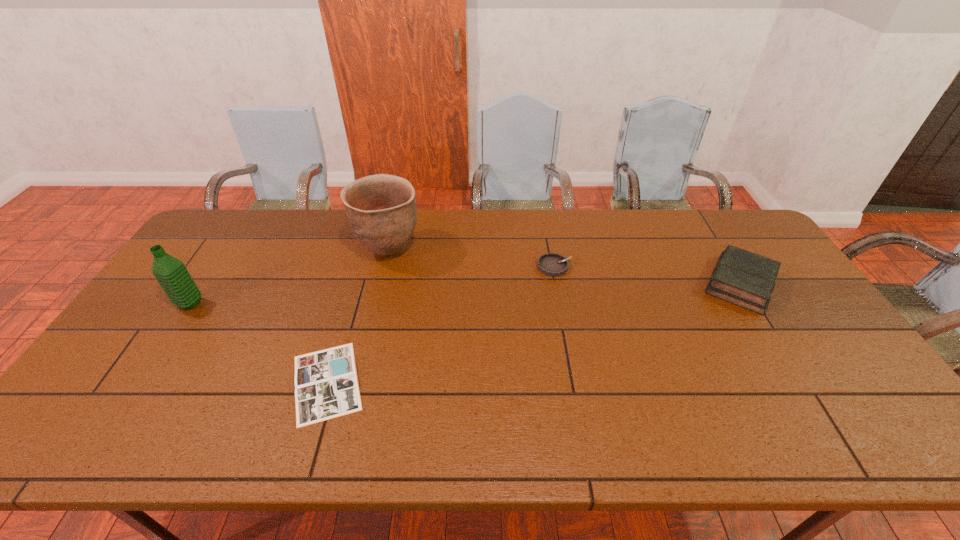
I want to click on free space located 0.070m on the back of the rightmost object, so click(714, 243).

The height and width of the screenshot is (540, 960). I want to click on vacant space situated on the right of the fourth tallest object, so click(x=594, y=266).

The height and width of the screenshot is (540, 960). What are the coordinates of `vacant space situated 0.230m on the back of the nearer book` in the screenshot? It's located at (356, 284).

Where is `object at the far edge`? object at the far edge is located at coordinates (381, 209).

Find the location of a particular element. The width and height of the screenshot is (960, 540). object that is at the near edge is located at coordinates (326, 384).

The width and height of the screenshot is (960, 540). Identify the location of object located at the left edge. (172, 275).

Identify the location of object present at the right edge. (743, 278).

You are a GUI agent. You are given a task and a screenshot of the screen. Output one action in this format:
    pyautogui.click(x=<x>, y=<y>)
    Task: Click on the vacant space at the far edge
    The image size is (960, 540).
    Given the screenshot: What is the action you would take?
    pyautogui.click(x=492, y=251)

In the image, there is a desktop. Identify the location of vacant region at the near edge. (183, 418).

In order to click on free region at the far right corner of the desktop in this screenshot , I will do tap(724, 238).